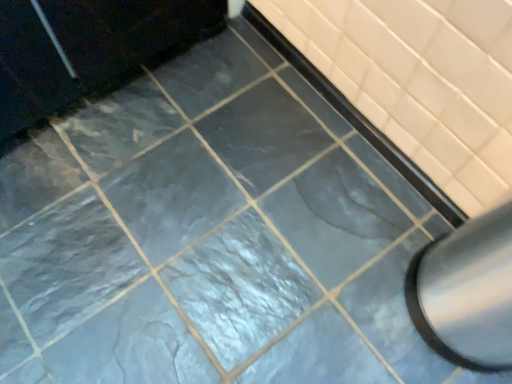
Question: From a real-world perspective, is matte black bathtub at center physically located above or below satin silver exhaust hood at lower right?

Choices:
 (A) above
 (B) below

Answer: (B)

Question: Is matte black bathtub at center spatially inside satin silver exhaust hood at lower right, or outside of it?

Choices:
 (A) inside
 (B) outside

Answer: (B)

Question: Considering their positions, is matte black bathtub at center located in front of or behind satin silver exhaust hood at lower right?

Choices:
 (A) front
 (B) behind

Answer: (B)

Question: From a real-world perspective, is satin silver exhaust hood at lower right physically located above or below matte black bathtub at center?

Choices:
 (A) above
 (B) below

Answer: (A)

Question: Based on their positions, is satin silver exhaust hood at lower right located to the left or right of matte black bathtub at center?

Choices:
 (A) right
 (B) left

Answer: (A)

Question: Is satin silver exhaust hood at lower right bigger or smaller than matte black bathtub at center?

Choices:
 (A) big
 (B) small

Answer: (A)

Question: Is satin silver exhaust hood at lower right wider or thinner than matte black bathtub at center?

Choices:
 (A) thin
 (B) wide

Answer: (B)